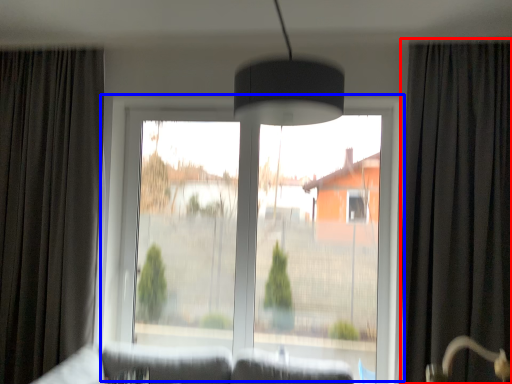
Question: Which object is further to the camera taking this photo, curtain (highlighted by a red box) or window (highlighted by a blue box)?

Choices:
 (A) curtain
 (B) window

Answer: (B)